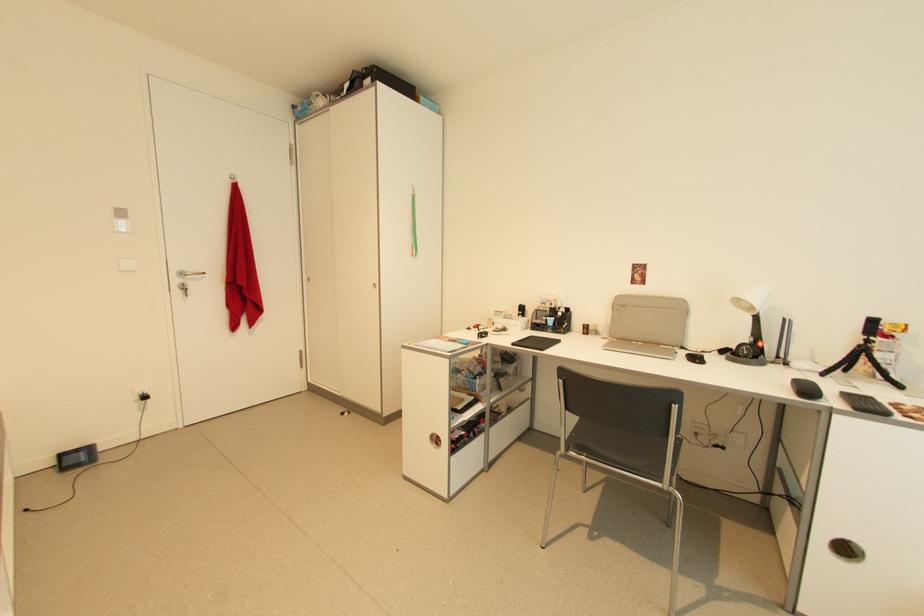
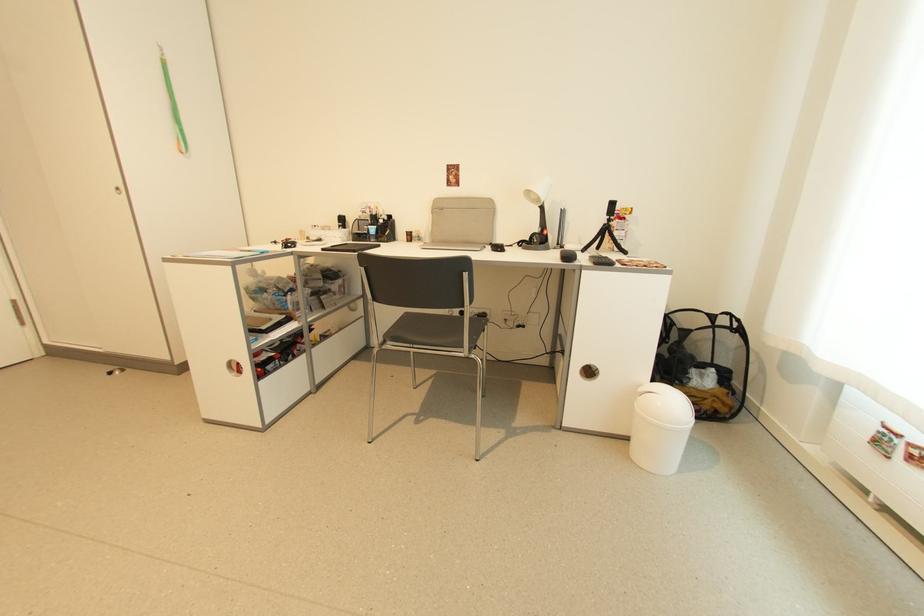
Locate, in the second image, the point that corresponds to [860,411] in the first image.

(600, 265)